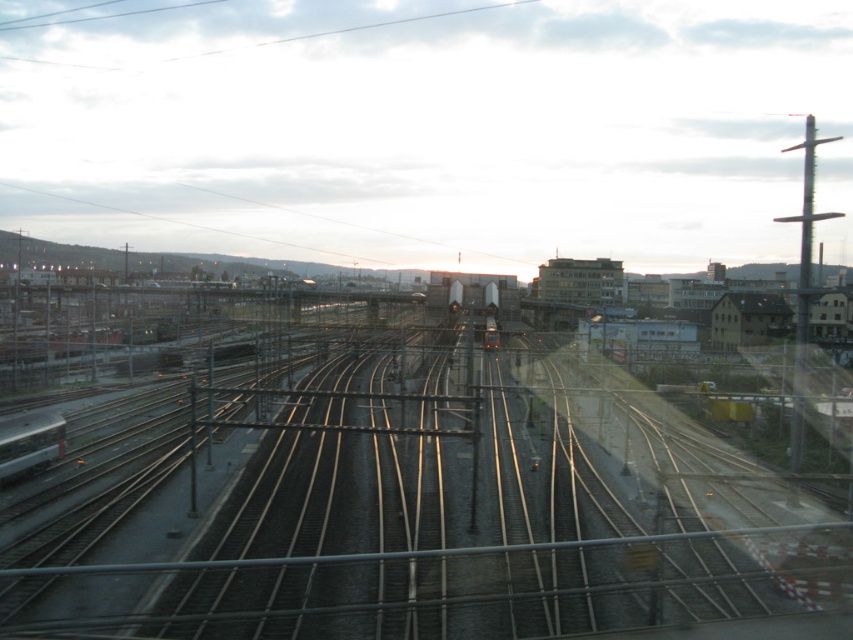
You are a photographer standing on the platform. You want to take a photo of the metallic silver train at center and the metal tracks at center. Which object will appear larger in your photo?

The metal tracks at center will appear larger in the photo because they are much taller than the metallic silver train at center.

You are standing at the center of the railway tracks and see the metallic silver train at lower left. According to the coordinates given, is the train closer to you or farther away?

The metallic silver train at lower left is located at point 0.038 on the vertical axis, which indicates it is closer to the viewer since lower values on the vertical axis typically represent closer proximity in such coordinate systems.

You are a passenger on the metallic silver train at lower left and want to get to the metallic silver train at center. Can you walk directly towards it along the tracks?

The metallic silver train at lower left is closer to the viewer than the metallic silver train at center, so you can walk directly towards it along the tracks.